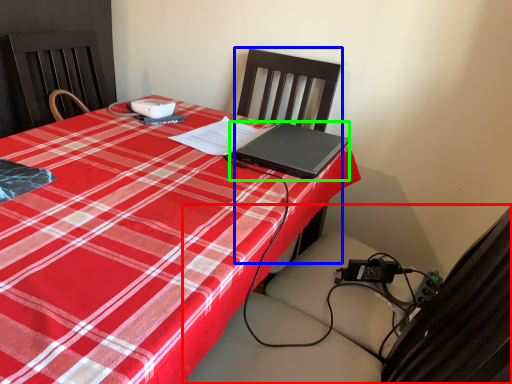
Question: Which is farther away from swivel chair (highlighted by a red box)? chair (highlighted by a blue box) or laptop (highlighted by a green box)?

Choices:
 (A) chair
 (B) laptop

Answer: (A)